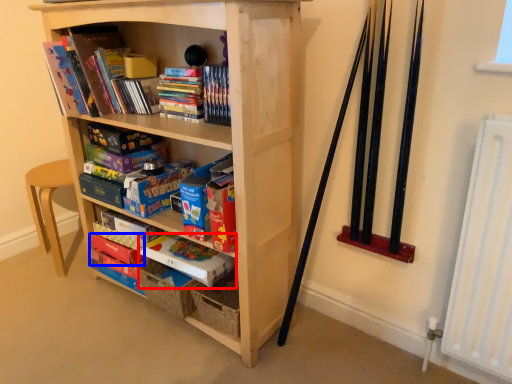
Question: Which of the following is the farthest to the observer, paperback book (highlighted by a red box) or paperback book (highlighted by a blue box)?

Choices:
 (A) paperback book
 (B) paperback book

Answer: (B)